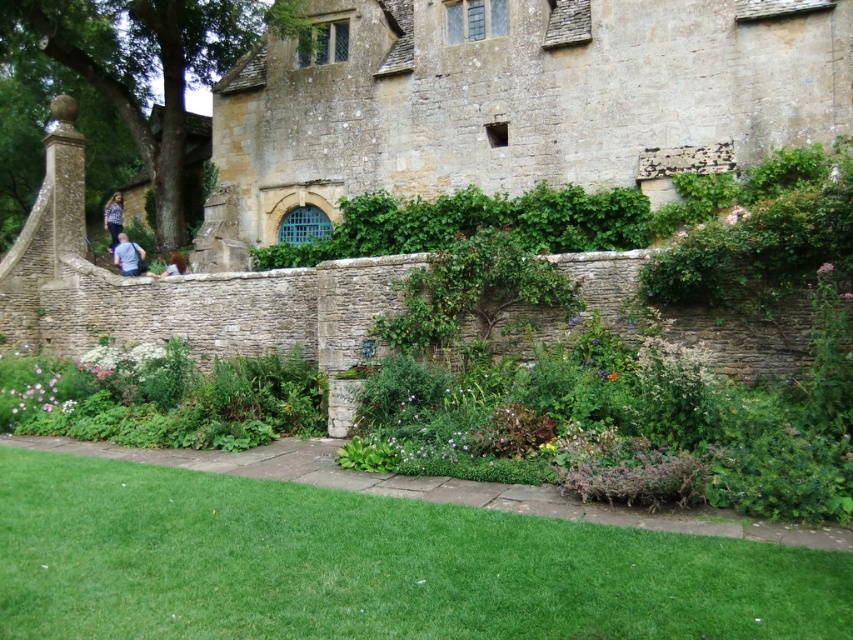
Question: Is green grass at lower center behind light blue shirt at upper left?

Choices:
 (A) no
 (B) yes

Answer: (A)

Question: Does light blue shirt at upper left appear under denim jacket at upper left?

Choices:
 (A) no
 (B) yes

Answer: (B)

Question: Is denim jacket at upper left positioned in front of light brown hair at center?

Choices:
 (A) yes
 (B) no

Answer: (B)

Question: Among these points, which one is nearest to the camera?

Choices:
 (A) (111, 209)
 (B) (135, 268)
 (C) (167, 262)
 (D) (532, 237)

Answer: (D)

Question: Which object appears closest to the camera in this image?

Choices:
 (A) denim jacket at upper left
 (B) light blue shirt at upper left
 (C) green leafy hedge at center
 (D) green grass at lower center

Answer: (D)

Question: Which object appears farthest from the camera in this image?

Choices:
 (A) denim jacket at upper left
 (B) light brown hair at center
 (C) green leafy hedge at center
 (D) light blue shirt at upper left

Answer: (A)